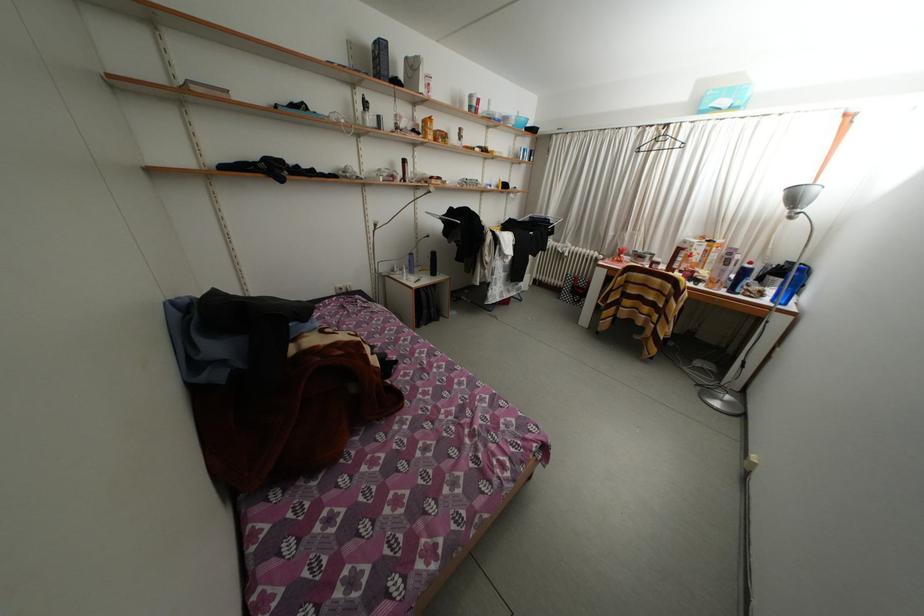
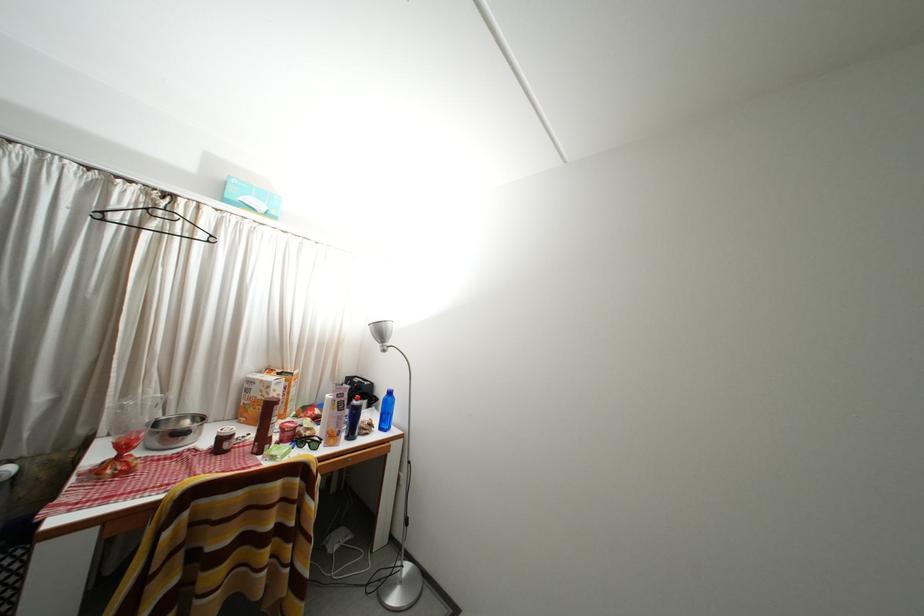
Find the pixel in the second image that matches (693,246) in the first image.

(259, 387)